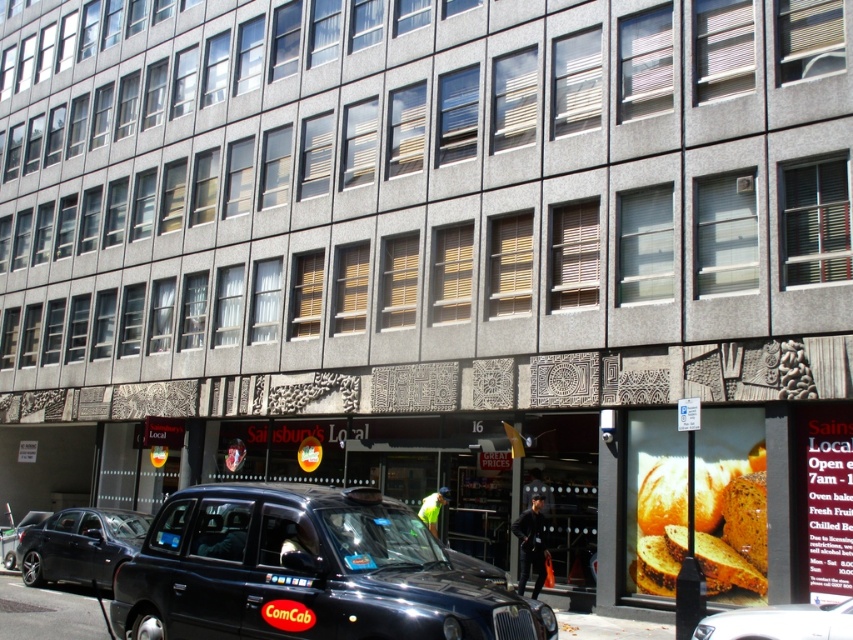
Is point (479, 596) farther from camera compared to point (39, 513)?

No, it is in front of (39, 513).

Is point (247, 595) positioned in front of point (9, 538)?

Yes, it is in front of point (9, 538).

Who is more forward, (178, 611) or (21, 518)?

Point (178, 611) is more forward.

This screenshot has width=853, height=640. I want to click on shiny black taxi at center, so click(306, 572).

Is point (106, 536) positioned before point (792, 604)?

No, it is not.

In order to click on shiny black taxi at lower left in this screenshot , I will do `click(80, 545)`.

This screenshot has height=640, width=853. In order to click on shiny black taxi at center in this screenshot , I will do `click(306, 572)`.

Which is below, shiny black taxi at center or black plastic license plate at center?

Positioned lower is shiny black taxi at center.

This screenshot has width=853, height=640. Describe the element at coordinates (306, 572) in the screenshot. I see `shiny black taxi at center` at that location.

Where is `shiny black taxi at center`? This screenshot has width=853, height=640. shiny black taxi at center is located at coordinates (306, 572).